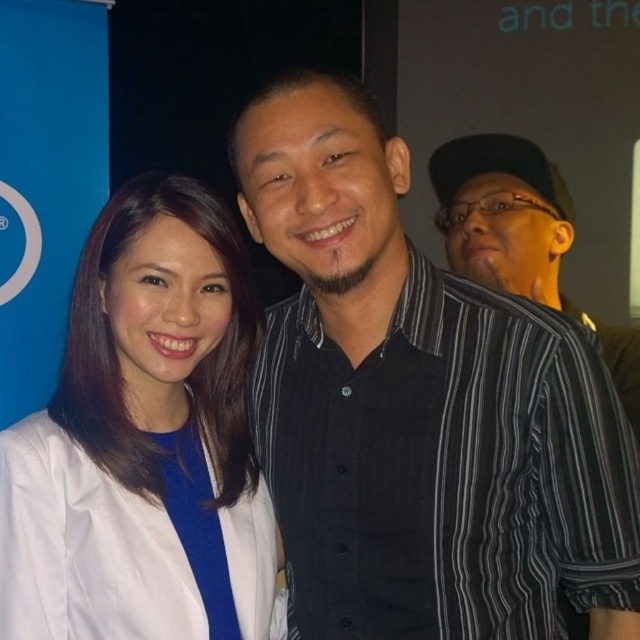
Question: Among these points, which one is nearest to the camera?

Choices:
 (A) (531, 205)
 (B) (273, 317)

Answer: (B)

Question: Which of the following is the closest to the observer?

Choices:
 (A) black striped shirt at center
 (B) white matte coat at left

Answer: (A)

Question: Is white matte coat at left positioned behind black striped shirt at right?

Choices:
 (A) yes
 (B) no

Answer: (B)

Question: Which object appears farthest from the camera in this image?

Choices:
 (A) black striped shirt at right
 (B) white matte coat at left

Answer: (A)

Question: Can you confirm if black striped shirt at center is positioned above white matte coat at left?

Choices:
 (A) yes
 (B) no

Answer: (A)

Question: Does black striped shirt at center have a larger size compared to white matte coat at left?

Choices:
 (A) no
 (B) yes

Answer: (B)